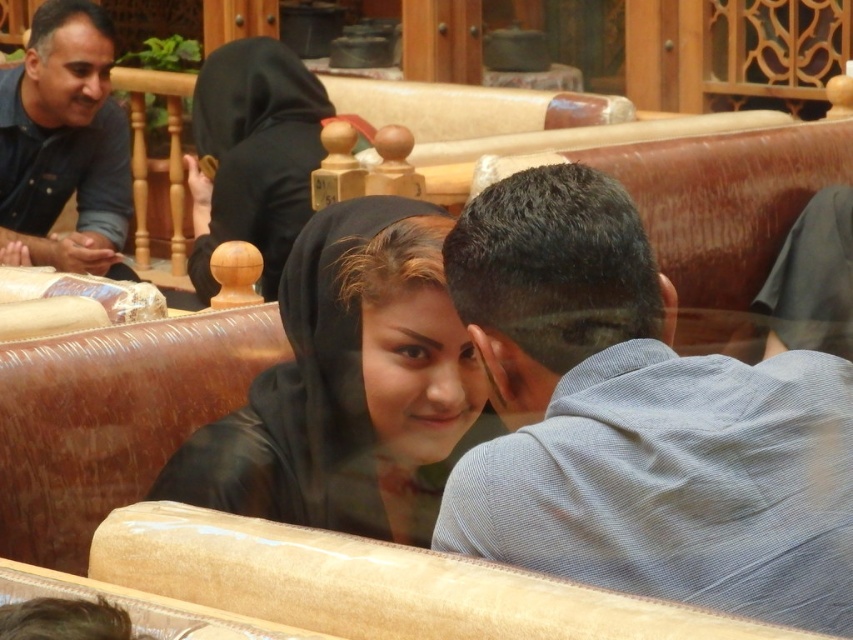
You are standing in the restaurant and want to locate the light blue striped shirt at center. According to the coordinates provided, where exactly is it positioned in the image?

The light blue striped shirt at center is located at the coordinates point (637, 420).

You are a photographer trying to capture a candid shot of the light blue striped shirt at center without including the dark blue shirt on the left. Based on their positions, can you determine if the point marked at coordinates [637,420] on the light blue striped shirt at center is within the frame of the shot?

The point marked at coordinates [637,420] on the light blue striped shirt at center is within the frame of the shot, so the photographer can capture the light blue striped shirt at center without including the dark blue shirt on the left.

You are an interior designer analyzing the layout of this social space. Given the coordinates provided for the light blue striped shirt at center, which is located at point 0.658 on the x and 0.749 on the y axis, how would you describe its position relative to the center of the image?

The light blue striped shirt at center is positioned slightly to the right and above the center of the image since its coordinates are 0.658 on the x and 0.749 on the y axis.